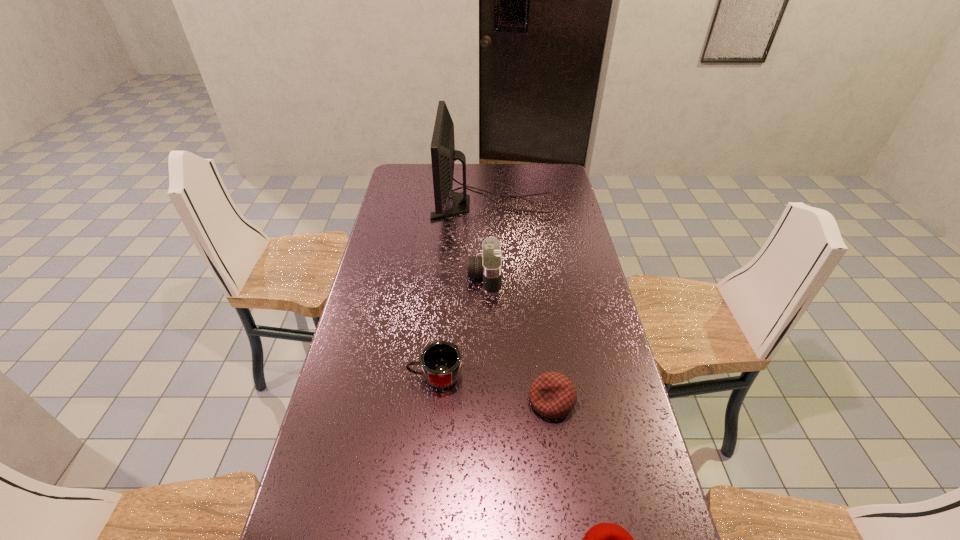
In the image, there is a desktop. Where is `free space at the far edge`? free space at the far edge is located at coordinates (479, 166).

Identify the location of vacant space at the left edge of the desktop. The image size is (960, 540). (391, 195).

In order to click on free region at the right edge in this screenshot , I will do `click(578, 316)`.

In the image, there is a desktop. Where is `vacant space at the far right corner`? The height and width of the screenshot is (540, 960). vacant space at the far right corner is located at coordinates (563, 178).

The width and height of the screenshot is (960, 540). Find the location of `free spot between the computer monitor and the farther beanbag`. free spot between the computer monitor and the farther beanbag is located at coordinates (522, 303).

Locate an element on the screen. free space between the farther beanbag and the farthest object is located at coordinates (522, 303).

Locate an element on the screen. This screenshot has height=540, width=960. free space between the fourth nearest object and the third tallest object is located at coordinates (460, 327).

At what (x,y) coordinates should I click in order to perform the action: click on vacant point located between the mug and the farther beanbag. Please return your answer as a coordinate pair (x, y). The height and width of the screenshot is (540, 960). Looking at the image, I should click on (493, 389).

The width and height of the screenshot is (960, 540). I want to click on free space between the farther beanbag and the farthest object, so click(x=522, y=303).

Locate which object is the third closest to the nearer beanbag. Please provide its 2D coordinates. Your answer should be formatted as a tuple, i.e. [(x, y)], where the tuple contains the x and y coordinates of a point satisfying the conditions above.

[(489, 266)]